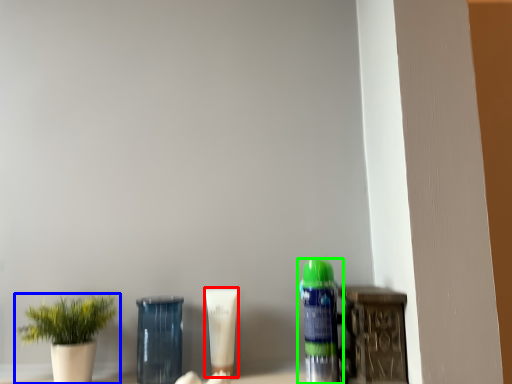
Question: Based on their relative distances, which object is nearer to product (highlighted by a red box)? Choose from houseplant (highlighted by a blue box) and bottle (highlighted by a green box).

Choices:
 (A) houseplant
 (B) bottle

Answer: (B)